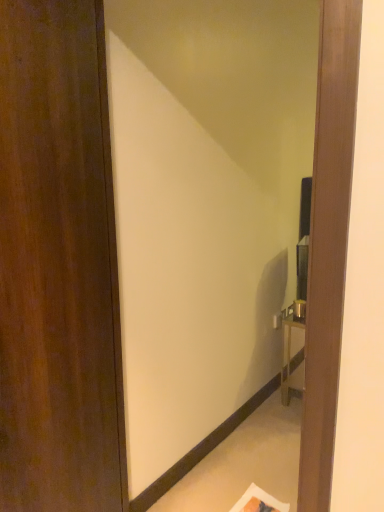
This screenshot has height=512, width=384. What do you see at coordinates (204, 208) in the screenshot?
I see `matte wood mirror at center` at bounding box center [204, 208].

You are a GUI agent. You are given a task and a screenshot of the screen. Output one action in this format:
    pyautogui.click(x=<x>, y=<y>)
    Task: Click on the matte wood mirror at center
    
    Given the screenshot: What is the action you would take?
    pyautogui.click(x=204, y=208)

This screenshot has width=384, height=512. Describe the element at coordinates (57, 263) in the screenshot. I see `dark wood door at left` at that location.

What is the approximate width of dark wood door at left?

dark wood door at left is 5.70 inches in width.

Where is `dark wood door at left`? The image size is (384, 512). dark wood door at left is located at coordinates (57, 263).

Locate an element on the screen. This screenshot has height=512, width=384. matte wood mirror at center is located at coordinates (204, 208).

Looking at this image, considering the relative positions of dark wood door at left and matte wood mirror at center in the image provided, is dark wood door at left to the right of matte wood mirror at center from the viewer's perspective?

In fact, dark wood door at left is to the left of matte wood mirror at center.

Is the depth of dark wood door at left less than that of matte wood mirror at center?

Yes, dark wood door at left is closer to the camera.

Which is in front, point (59, 501) or point (115, 10)?

The point (59, 501) is closer.

From the image's perspective, which object appears higher, dark wood door at left or matte wood mirror at center?

matte wood mirror at center appears higher in the image.

From a real-world perspective, does dark wood door at left stand above matte wood mirror at center?

Yes.

Which of these two, dark wood door at left or matte wood mirror at center, is wider?

dark wood door at left is wider.

Who is shorter, dark wood door at left or matte wood mirror at center?

Standing shorter between the two is dark wood door at left.

Based on their sizes in the image, would you say dark wood door at left is bigger or smaller than matte wood mirror at center?

In the image, dark wood door at left appears to be smaller than matte wood mirror at center.

Would you say dark wood door at left contains matte wood mirror at center?

No, matte wood mirror at center is located outside of dark wood door at left.

Is dark wood door at left positioned far away from matte wood mirror at center?

Actually, dark wood door at left and matte wood mirror at center are a little close together.

Could you tell me if dark wood door at left is turned towards matte wood mirror at center?

Yes, dark wood door at left is turned towards matte wood mirror at center.

What's the angular difference between dark wood door at left and matte wood mirror at center's facing directions?

dark wood door at left and matte wood mirror at center are facing 107 degrees away from each other.

The image size is (384, 512). I want to click on door above the matte wood mirror at center (from a real-world perspective), so click(57, 263).

Between matte wood mirror at center and dark wood door at left, which one appears on the right side from the viewer's perspective?

Positioned to the right is matte wood mirror at center.

Does matte wood mirror at center come behind dark wood door at left?

Yes, it is.

Which is closer, (x=187, y=313) or (x=92, y=276)?

The point (x=92, y=276) is in front.

In the scene shown: From the image's perspective, would you say matte wood mirror at center is shown under dark wood door at left?

Actually, matte wood mirror at center appears above dark wood door at left in the image.

From a real-world perspective, who is located higher, matte wood mirror at center or dark wood door at left?

dark wood door at left.

Is matte wood mirror at center wider than dark wood door at left?

Incorrect, the width of matte wood mirror at center does not surpass that of dark wood door at left.

Which of these two, matte wood mirror at center or dark wood door at left, stands taller?

matte wood mirror at center.

Is matte wood mirror at center smaller than dark wood door at left?

Incorrect, matte wood mirror at center is not smaller in size than dark wood door at left.

In the scene shown: Is dark wood door at left completely or partially inside matte wood mirror at center?

No, matte wood mirror at center does not contain dark wood door at left.

Would you say matte wood mirror at center is a long distance from dark wood door at left?

No, matte wood mirror at center is in close proximity to dark wood door at left.

Is dark wood door at left at the back of matte wood mirror at center?

Yes, dark wood door at left is at the back of matte wood mirror at center.

At what (x,y) coordinates should I click in order to perform the action: click on mirror directly beneath the dark wood door at left (from a real-world perspective). Please return your answer as a coordinate pair (x, y). This screenshot has height=512, width=384. Looking at the image, I should click on (204, 208).

Locate an element on the screen. Image resolution: width=384 pixels, height=512 pixels. door above the matte wood mirror at center (from a real-world perspective) is located at coordinates (57, 263).

This screenshot has width=384, height=512. I want to click on door below the matte wood mirror at center (from the image's perspective), so click(x=57, y=263).